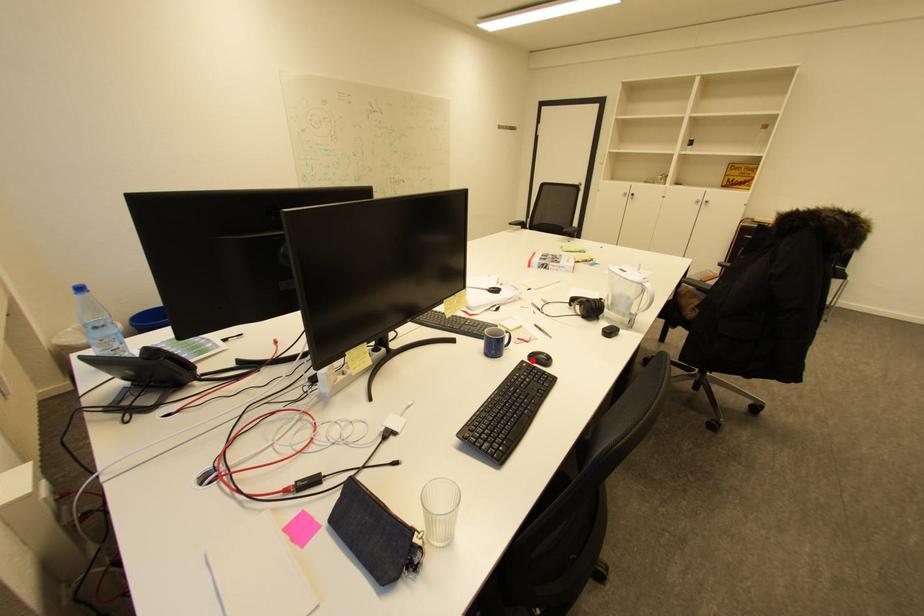
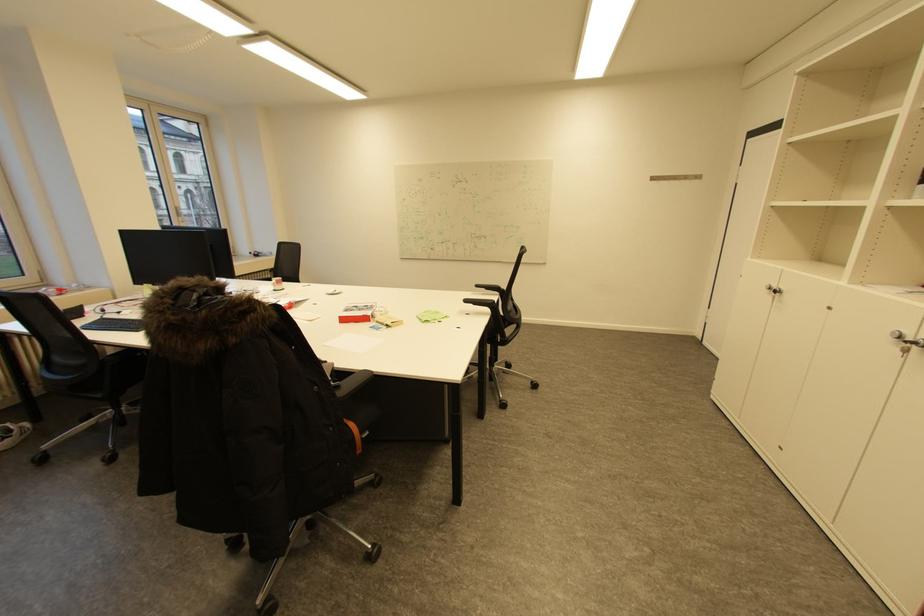
Question: I am providing you with two images of the same scene from different viewpoints. A red point is marked on the first image. Can you still see the location of the red point in image 2?

Choices:
 (A) Yes
 (B) No

Answer: (B)